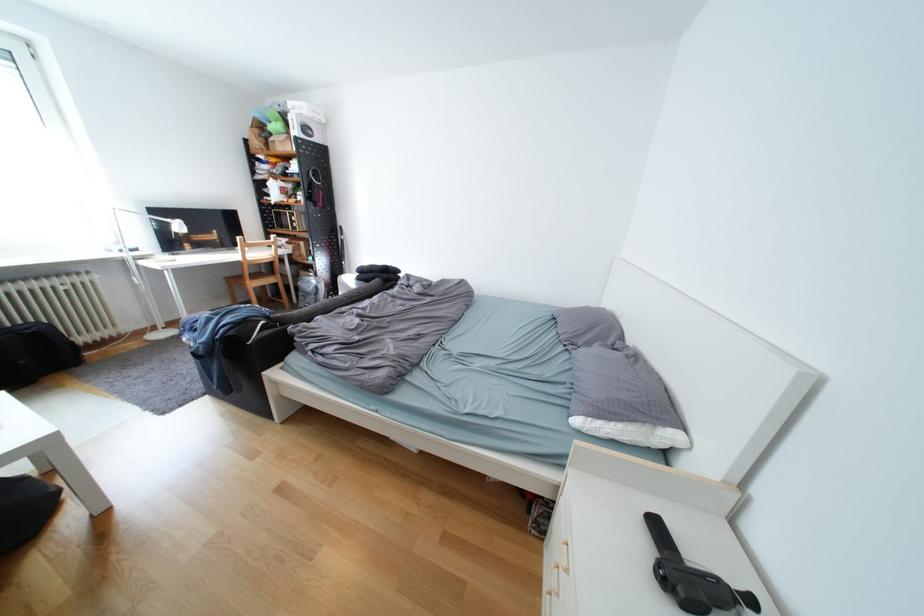
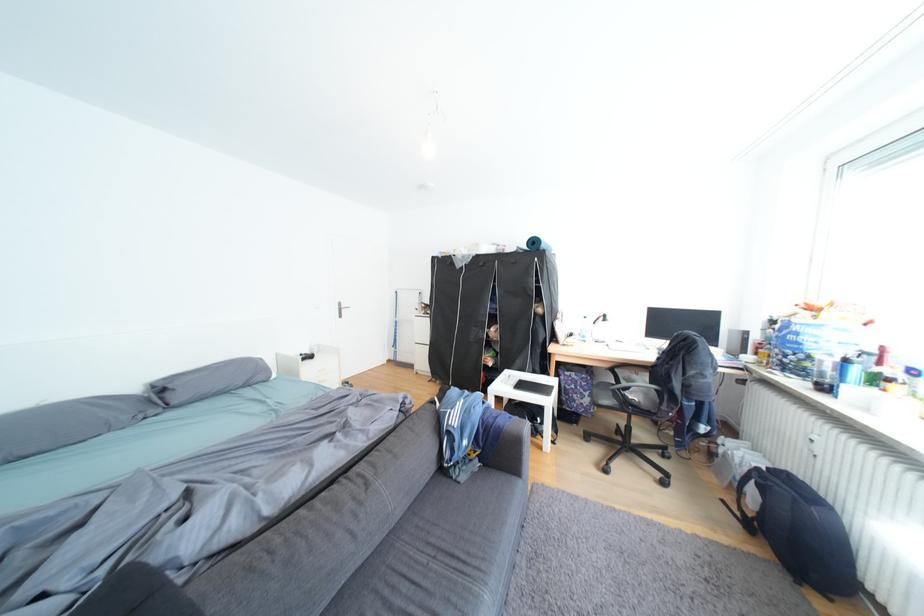
Question: I am providing you with two images of the same scene from different viewpoints. Which of the following objects are not visible in image2?

Choices:
 (A) white zipper pull
 (B) microwave door handle
 (C) grey pillow
 (D) silver door handle

Answer: (B)